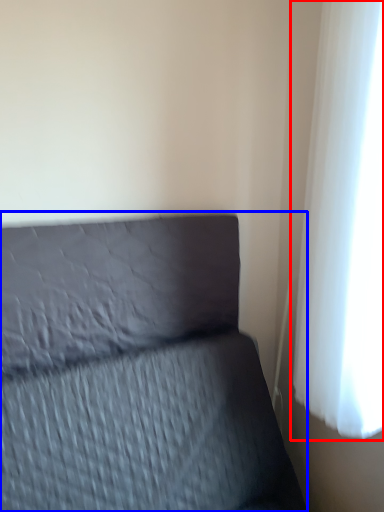
Question: Which point is closer to the camera, curtain (highlighted by a red box) or furniture (highlighted by a blue box)?

Choices:
 (A) curtain
 (B) furniture

Answer: (B)